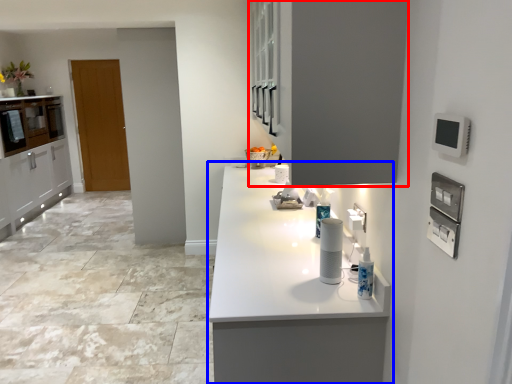
Question: Which object is further to the camera taking this photo, cabinetry (highlighted by a red box) or countertop (highlighted by a blue box)?

Choices:
 (A) cabinetry
 (B) countertop

Answer: (B)